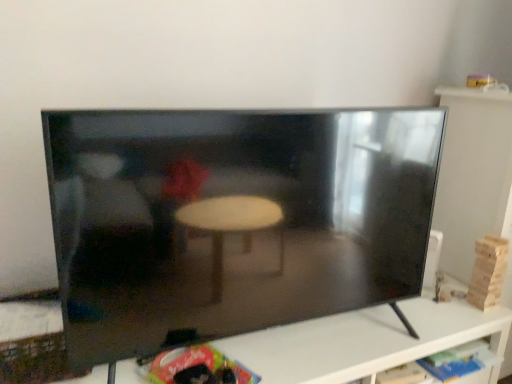
Question: Is black glossy tv at center in front of or behind black glossy tv at center in the image?

Choices:
 (A) front
 (B) behind

Answer: (A)

Question: Is point (216, 155) closer or farther from the camera than point (398, 354)?

Choices:
 (A) farther
 (B) closer

Answer: (B)

Question: Looking at the image, does black glossy tv at center seem bigger or smaller compared to black glossy tv at center?

Choices:
 (A) big
 (B) small

Answer: (B)

Question: Considering their positions, is black glossy tv at center located in front of or behind black glossy tv at center?

Choices:
 (A) front
 (B) behind

Answer: (B)

Question: Considering the positions of point (430, 332) and point (200, 201), is point (430, 332) closer or farther from the camera than point (200, 201)?

Choices:
 (A) closer
 (B) farther

Answer: (B)

Question: From the image's perspective, is black glossy tv at center positioned above or below black glossy tv at center?

Choices:
 (A) below
 (B) above

Answer: (A)

Question: Would you say black glossy tv at center is inside or outside black glossy tv at center?

Choices:
 (A) outside
 (B) inside

Answer: (A)